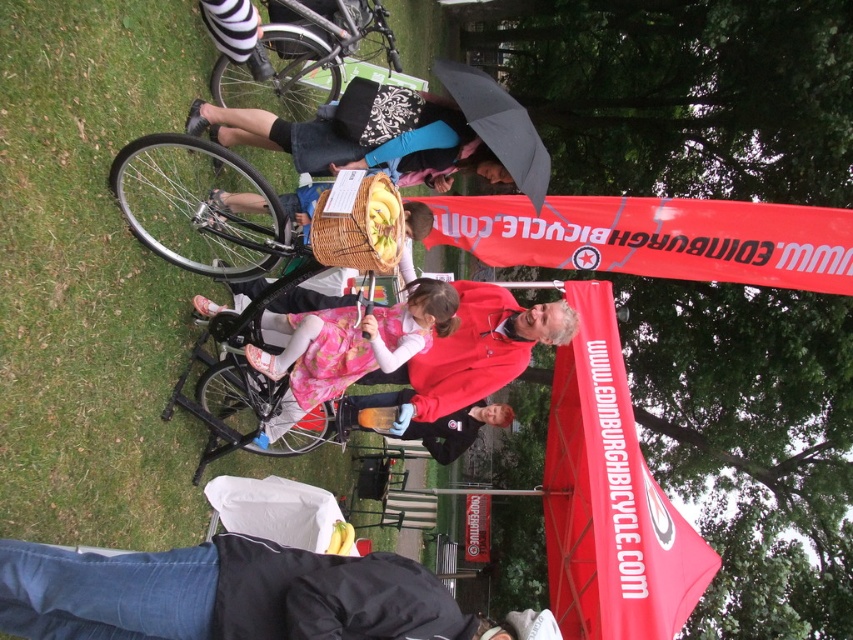
You are standing at the location where the viewer is positioned in the scene. You want to place a 2.5 meter long banner horizontally on the ground between you and the black matte bicycle at upper left. Is there enough space to lay it out fully without folding?

The distance between you and the black matte bicycle at upper left is 4.43 meters. Since the banner is 2.5 meters long, there is sufficient space to lay it out fully without folding.

You are setting up a booth for the Edinburgh Bicycle event. You have a black matte umbrella at upper center and a black matte bicycle at upper left. Which object requires more horizontal space to accommodate its width?

The black matte bicycle at upper left requires more horizontal space because its width is larger than the black matte umbrella at upper center.

You are standing at the center of the image and want to walk towards the green grass at lower left. Which direction should you face to move directly towards it?

To move directly towards the green grass at lower left from the center of the image, you should face the lower left direction since the grass is located at that position.